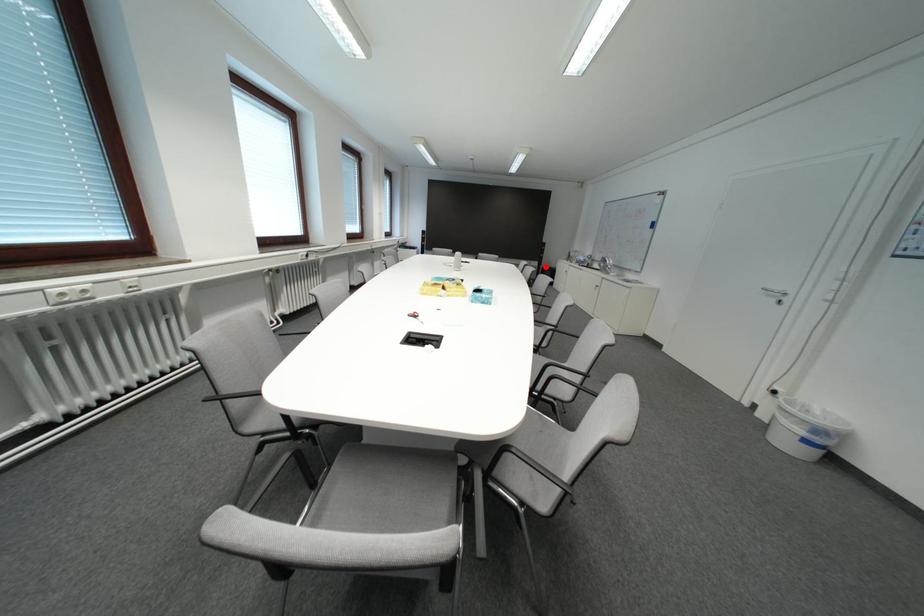
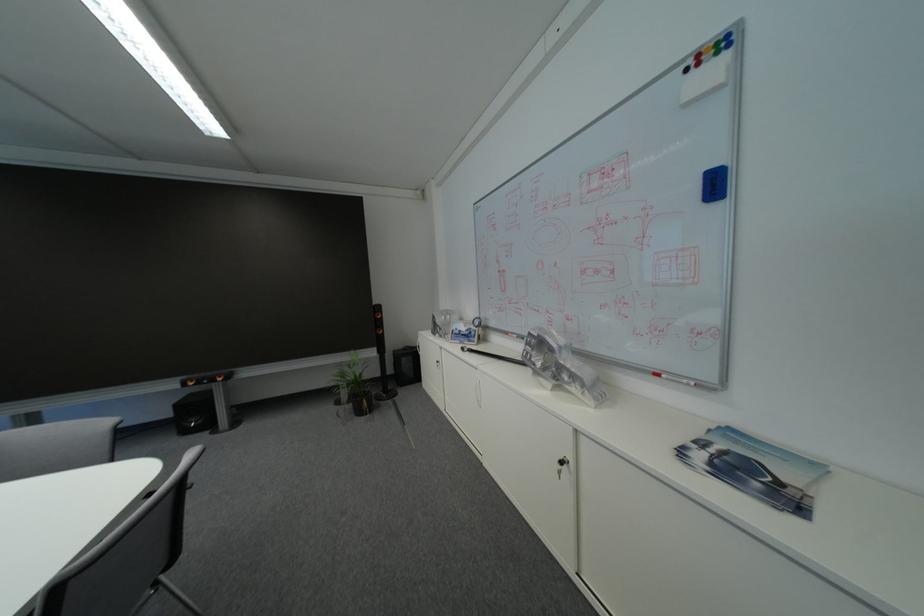
Find the pixel in the second image that matches the highlighted location in the first image.

(382, 355)